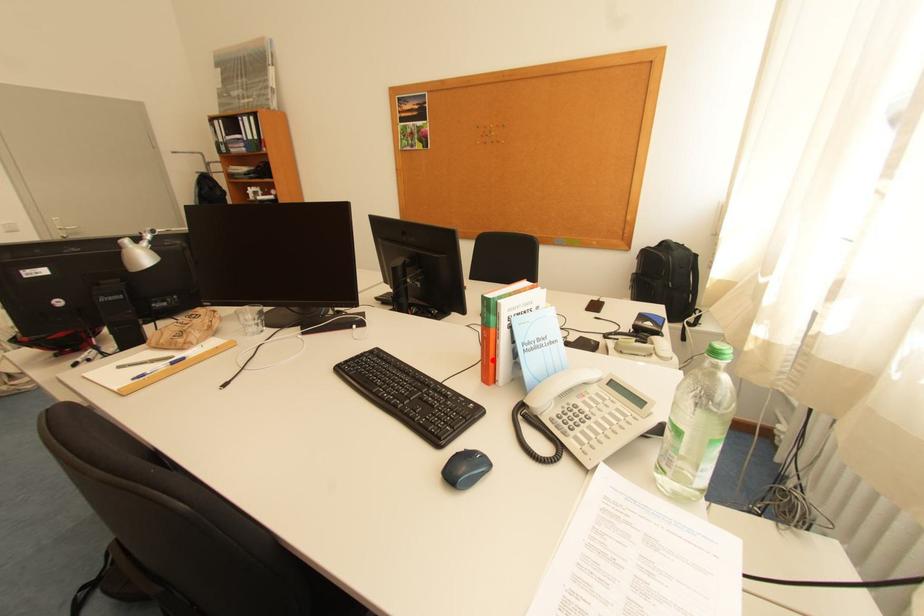
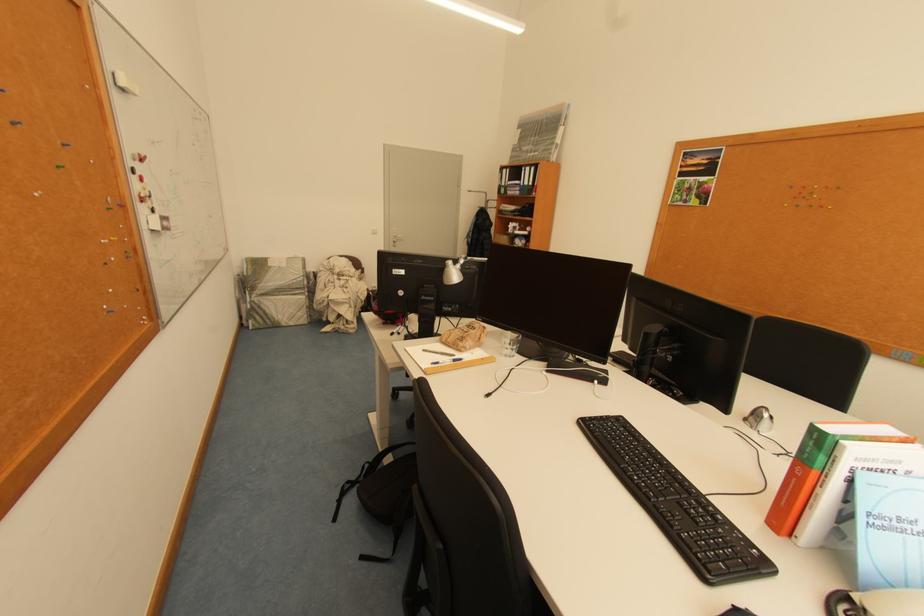
In the second image, find the point that corresponds to the highlighted location in the first image.

(793, 501)